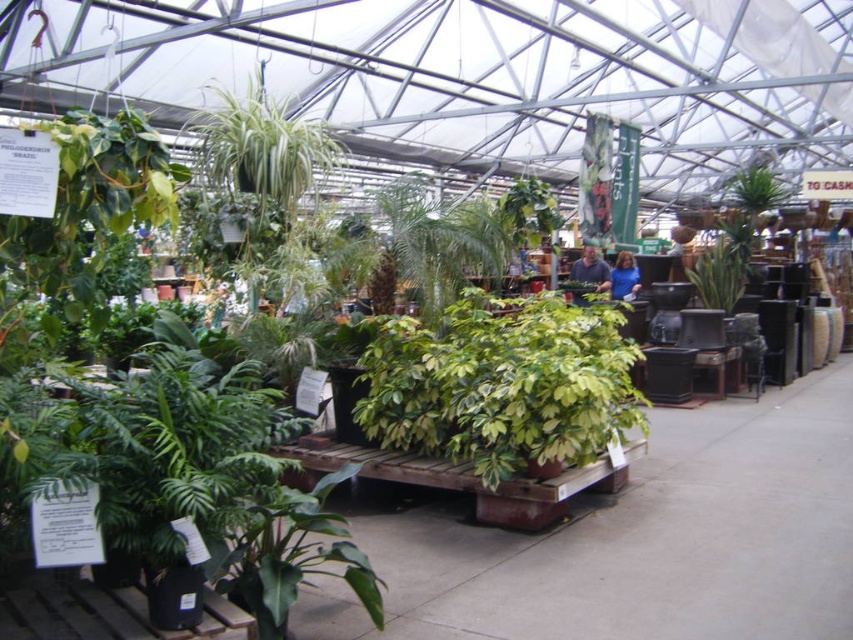
Based on the photo, is green matte leafy plant at lower center shorter than green glossy planter at center?

Yes, green matte leafy plant at lower center is shorter than green glossy planter at center.

Can you confirm if green matte leafy plant at lower center is bigger than green glossy planter at center?

Correct, green matte leafy plant at lower center is larger in size than green glossy planter at center.

Which is behind, point (277, 616) or point (695, 276)?

The point (695, 276) is behind.

Image resolution: width=853 pixels, height=640 pixels. What are the coordinates of `green matte leafy plant at lower center` in the screenshot? It's located at (289, 554).

Does green matte plant at center have a smaller size compared to green glossy planter at center?

Incorrect, green matte plant at center is not smaller in size than green glossy planter at center.

You are a GUI agent. You are given a task and a screenshot of the screen. Output one action in this format:
    pyautogui.click(x=<x>, y=<y>)
    Task: Click on the green matte plant at center
    The width and height of the screenshot is (853, 640).
    Given the screenshot: What is the action you would take?
    pyautogui.click(x=502, y=384)

Which is in front, point (267, 609) or point (231, 152)?

Positioned in front is point (267, 609).

What are the coordinates of `green matte leafy plant at lower center` in the screenshot? It's located at (289, 554).